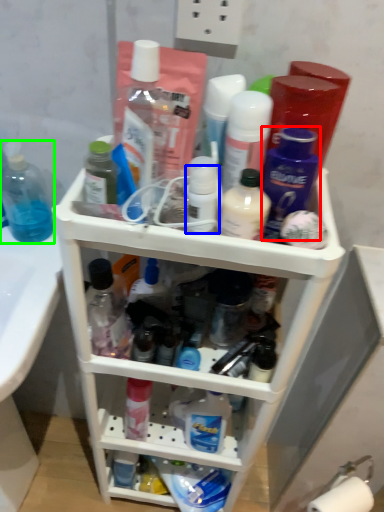
Question: Which is farther away from toiletry (highlighted by a red box)? toiletry (highlighted by a blue box) or bottle (highlighted by a green box)?

Choices:
 (A) toiletry
 (B) bottle

Answer: (B)